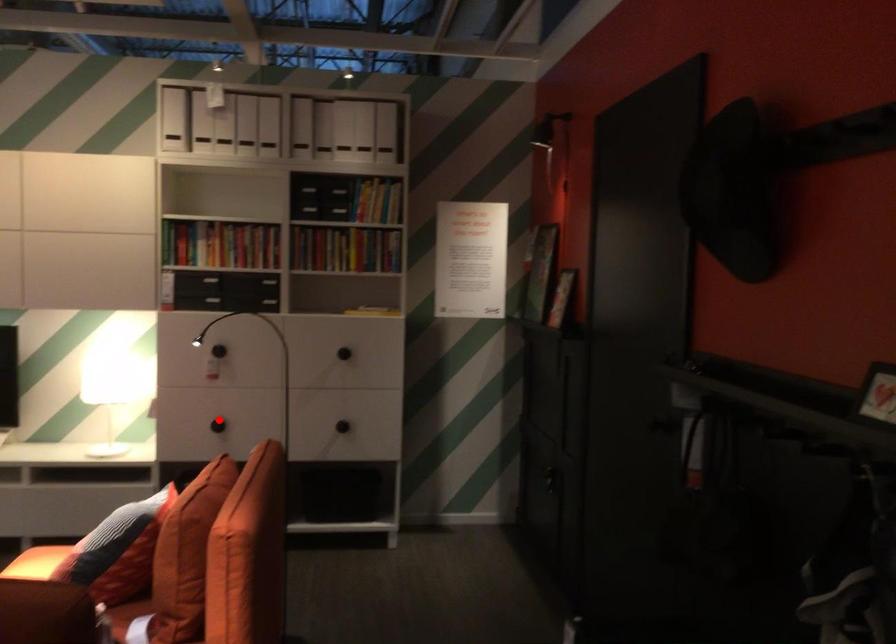
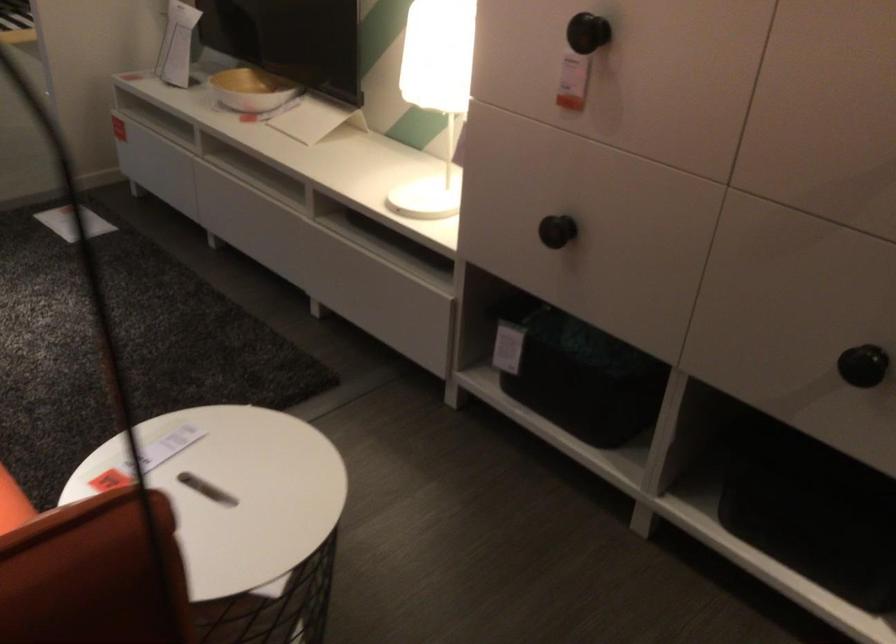
Question: A red point is marked in image1. In image2, is the corresponding 3D point closer to the camera or farther? Reply with the corresponding letter.

Choices:
 (A) The corresponding 3D point is closer.
 (B) The corresponding 3D point is farther.

Answer: (A)